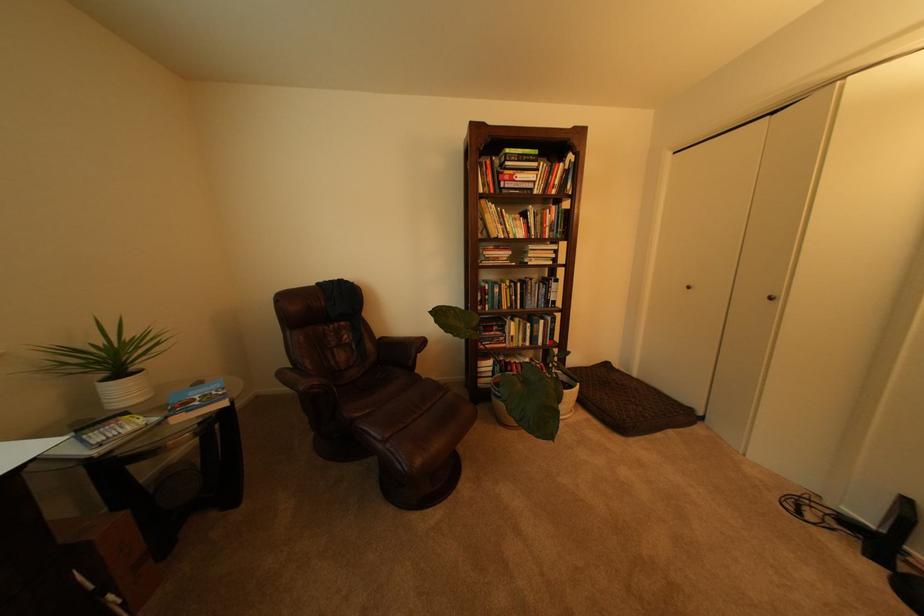
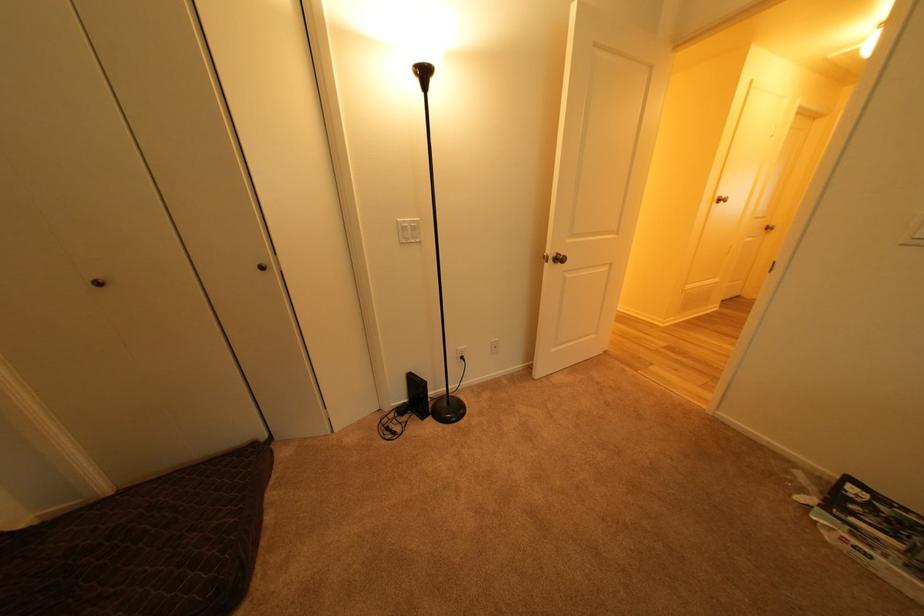
Locate, in the second image, the point that corresponds to [883,528] in the first image.

(417, 402)